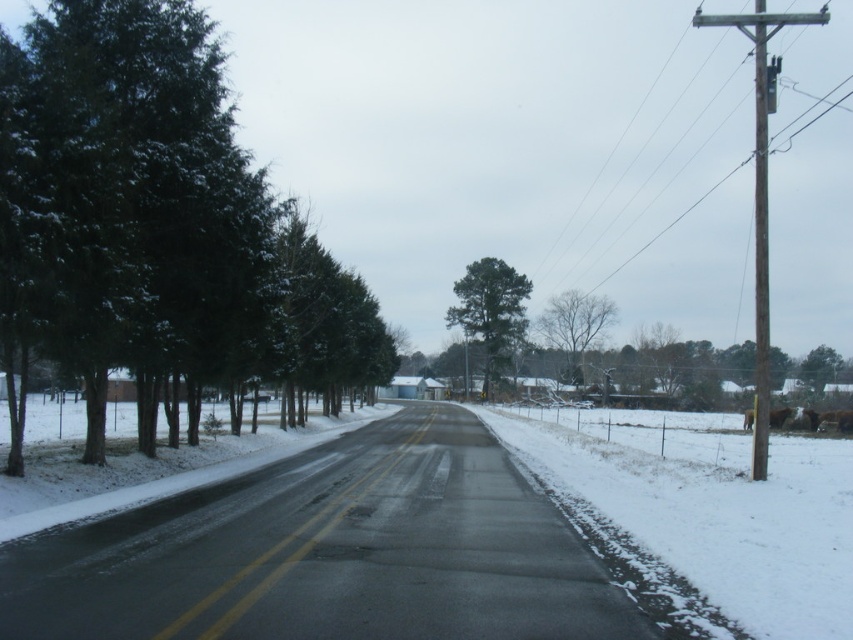
Does green matte tree at center appear over black asphalt road at center?

Yes.

Between green matte tree at center and black asphalt road at center, which one appears on the right side from the viewer's perspective?

From the viewer's perspective, green matte tree at center appears more on the right side.

Does point (451, 317) come closer to viewer compared to point (230, 625)?

That is False.

The height and width of the screenshot is (640, 853). I want to click on green matte tree at center, so (x=490, y=310).

Does green matte trees at left lie in front of bare branches at center?

Yes, green matte trees at left is in front of bare branches at center.

Who is taller, green matte trees at left or bare branches at center?

bare branches at center is taller.

What do you see at coordinates (160, 227) in the screenshot?
I see `green matte trees at left` at bounding box center [160, 227].

The width and height of the screenshot is (853, 640). I want to click on green matte trees at left, so click(x=160, y=227).

Is point (474, 333) closer to viewer compared to point (566, 326)?

No, it is not.

Does green matte tree at center have a greater width compared to bare branches at center?

In fact, green matte tree at center might be narrower than bare branches at center.

You are a GUI agent. You are given a task and a screenshot of the screen. Output one action in this format:
    pyautogui.click(x=<x>, y=<y>)
    Task: Click on the green matte tree at center
    Image resolution: width=853 pixels, height=640 pixels.
    Given the screenshot: What is the action you would take?
    pyautogui.click(x=490, y=310)